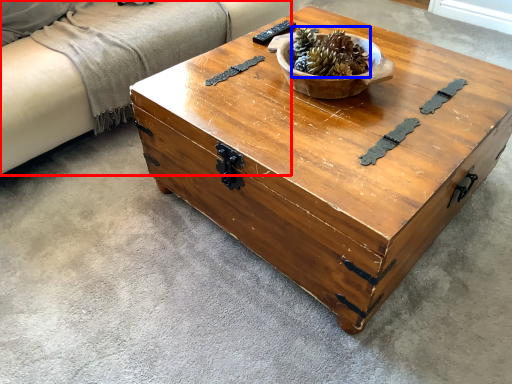
Question: Which of the following is the farthest to the observer, couch (highlighted by a red box) or centerpiece (highlighted by a blue box)?

Choices:
 (A) couch
 (B) centerpiece

Answer: (A)